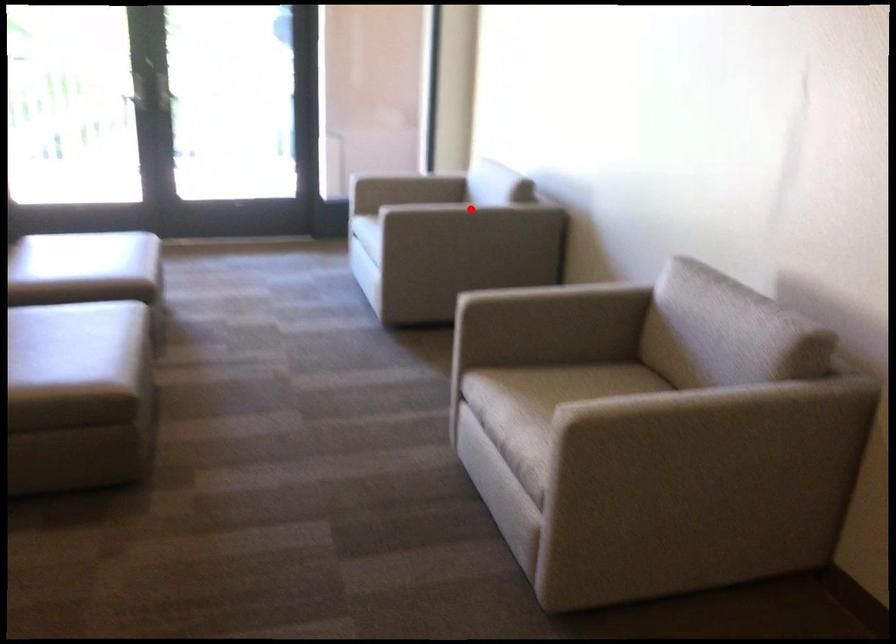
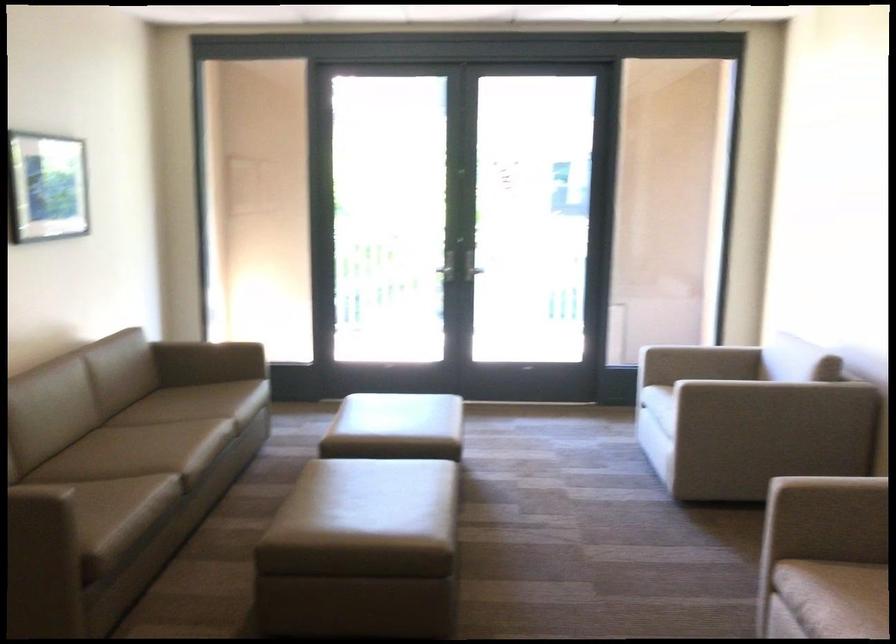
In the second image, find the point that corresponds to the highlighted location in the first image.

(774, 392)